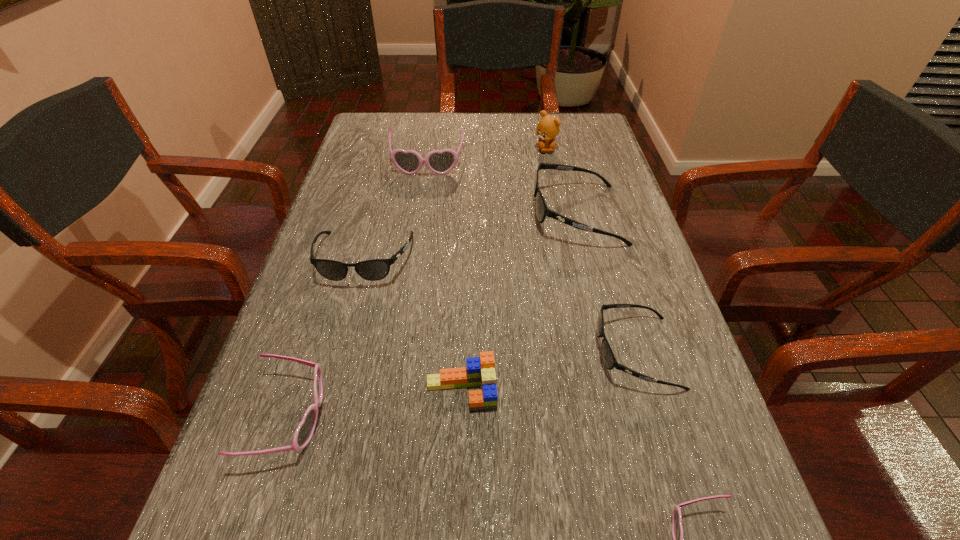
Identify the location of teddy bear located in the far edge section of the desktop. (547, 129).

Where is `sunglasses that is positioned at the far edge`? sunglasses that is positioned at the far edge is located at coordinates (410, 162).

Locate an element on the screen. The image size is (960, 540). teddy bear situated at the right edge is located at coordinates (547, 129).

This screenshot has width=960, height=540. Find the location of `object located in the far left corner section of the desktop`. object located in the far left corner section of the desktop is located at coordinates (410, 162).

Identify the location of object positioned at the far right corner. The height and width of the screenshot is (540, 960). [547, 129].

The width and height of the screenshot is (960, 540). Identify the location of vacant space at the far edge. (492, 140).

You are a GUI agent. You are given a task and a screenshot of the screen. Output one action in this format:
    pyautogui.click(x=<x>, y=<y>)
    Task: Click on the blank space at the left edge of the desktop
    The width and height of the screenshot is (960, 540).
    Given the screenshot: What is the action you would take?
    pyautogui.click(x=346, y=176)

At what (x,y) coordinates should I click in order to perform the action: click on vacant region at the right edge. Please return your answer as a coordinate pair (x, y). Looking at the image, I should click on (636, 288).

In the image, there is a desktop. Identify the location of vacant space at the far left corner. This screenshot has width=960, height=540. [x=391, y=123].

You are a GUI agent. You are given a task and a screenshot of the screen. Output one action in this format:
    pyautogui.click(x=<x>, y=<y>)
    Task: Click on the empty location between the brown teddy bear and the biggest gray sunglasses
    
    Given the screenshot: What is the action you would take?
    pyautogui.click(x=562, y=182)